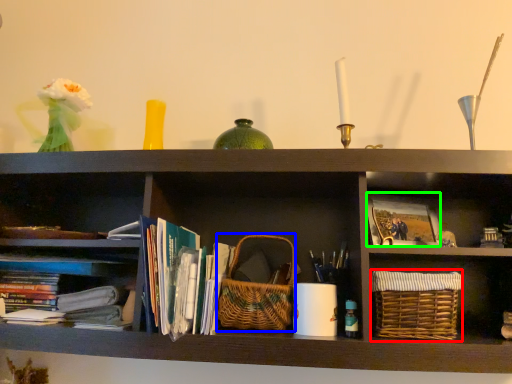
Question: Which object is the farthest from basket (highlighted by a red box)? Choose among these: basket (highlighted by a blue box) or paperback book (highlighted by a green box).

Choices:
 (A) basket
 (B) paperback book

Answer: (A)